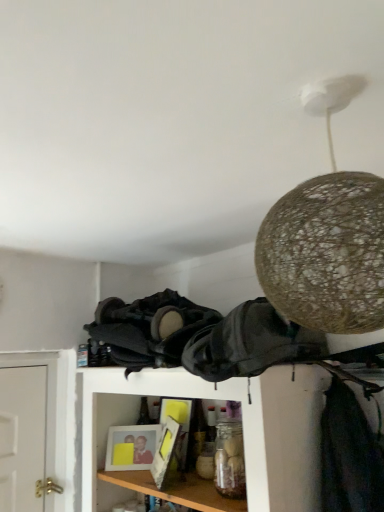
Find the location of a particular element. This screenshot has width=384, height=512. matte plastic picture frame at lower center is located at coordinates (131, 447).

Measure the distance between point (x=250, y=361) and camera.

Point (x=250, y=361) is 3.41 feet from camera.

Find the location of a particular element. This screenshot has height=512, width=384. woven beige lampshade at upper right is located at coordinates (327, 237).

Choose the correct answer: Is matte plastic picture frame at lower center inside black leather backpack at center, which ranks as the 1th clothing in right-to-left order, or outside it?

matte plastic picture frame at lower center cannot be found inside black leather backpack at center, which ranks as the 1th clothing in right-to-left order.

Locate an element on the screen. This screenshot has width=384, height=512. picture frame on the left of black leather backpack at center, which is the second clothing in left-to-right order is located at coordinates (131, 447).

Does matte plastic picture frame at lower center have a lesser height compared to black leather backpack at center, which ranks as the 1th clothing in right-to-left order?

Indeed, matte plastic picture frame at lower center has a lesser height compared to black leather backpack at center, which ranks as the 1th clothing in right-to-left order.

Which object is positioned more to the right, matte plastic picture frame at lower center or black leather backpack at center, which ranks as the 1th clothing in right-to-left order?

From the viewer's perspective, black leather backpack at center, which ranks as the 1th clothing in right-to-left order, appears more on the right side.

Where is `clothing that is the 2nd one when counting backward from the woven beige lampshade at upper right`? The image size is (384, 512). clothing that is the 2nd one when counting backward from the woven beige lampshade at upper right is located at coordinates (146, 330).

Can you confirm if black fabric at center, acting as the second clothing starting from the right, is wider than woven beige lampshade at upper right?

Incorrect, the width of black fabric at center, acting as the second clothing starting from the right, does not surpass that of woven beige lampshade at upper right.

Based on the photo, are black fabric at center, acting as the second clothing starting from the right, and woven beige lampshade at upper right far apart?

No.

Could you measure the distance between black fabric at center, which is the first clothing from left to right, and woven beige lampshade at upper right?

They are 28.91 inches apart.

From a real-world perspective, is black fabric at center, which is the first clothing from left to right, positioned above or below matte plastic picture frame at lower center?

In terms of real-world spatial position, black fabric at center, which is the first clothing from left to right, is above matte plastic picture frame at lower center.

From the image's perspective, would you say black fabric at center, which is the first clothing from left to right, is positioned over matte plastic picture frame at lower center?

Yes, from the image's perspective, black fabric at center, which is the first clothing from left to right, is on top of matte plastic picture frame at lower center.

Locate an element on the screen. the 1st clothing above the matte plastic picture frame at lower center (from the image's perspective) is located at coordinates (146, 330).

How much distance is there between black fabric at center, which is the first clothing from left to right, and matte plastic picture frame at lower center?

They are 17.53 inches apart.

Image resolution: width=384 pixels, height=512 pixels. In order to click on picture frame on the left of woven beige lampshade at upper right in this screenshot , I will do `click(131, 447)`.

Is matte plastic picture frame at lower center with woven beige lampshade at upper right?

matte plastic picture frame at lower center and woven beige lampshade at upper right are clearly separated.

Is matte plastic picture frame at lower center located outside black fabric at center, which is the first clothing from left to right?

Absolutely, matte plastic picture frame at lower center is external to black fabric at center, which is the first clothing from left to right.

Where is `picture frame to the left of black fabric at center, acting as the second clothing starting from the right`? This screenshot has width=384, height=512. picture frame to the left of black fabric at center, acting as the second clothing starting from the right is located at coordinates (131, 447).

Consider the image. Is matte plastic picture frame at lower center bigger than black fabric at center, acting as the second clothing starting from the right?

No.

Is black leather backpack at center, which ranks as the 1th clothing in right-to-left order, facing towards black fabric at center, which is the first clothing from left to right?

No.

How much distance is there between black leather backpack at center, which is the second clothing in left-to-right order, and black fabric at center, which is the first clothing from left to right?

black leather backpack at center, which is the second clothing in left-to-right order, and black fabric at center, which is the first clothing from left to right, are 8.59 inches apart from each other.

Does point (264, 370) appear closer or farther from the camera than point (107, 320)?

Point (264, 370) appears to be closer to the viewer than point (107, 320).

Is black leather backpack at center, which ranks as the 1th clothing in right-to-left order, directly adjacent to black fabric at center, acting as the second clothing starting from the right?

No.

From the image's perspective, is black fabric at center, which is the first clothing from left to right, under black leather backpack at center, which is the second clothing in left-to-right order?

Yes.

Is black fabric at center, which is the first clothing from left to right, far from black leather backpack at center, which is the second clothing in left-to-right order?

Actually, black fabric at center, which is the first clothing from left to right, and black leather backpack at center, which is the second clothing in left-to-right order, are a little close together.

I want to click on clothing that appears above the black fabric at center, which is the first clothing from left to right (from the image's perspective), so click(250, 344).

What are the coordinates of `the 2nd clothing positioned above the matte plastic picture frame at lower center (from the image's perspective)` in the screenshot? It's located at (250, 344).

Where is `lamp in front of the black fabric at center, acting as the second clothing starting from the right`? Image resolution: width=384 pixels, height=512 pixels. lamp in front of the black fabric at center, acting as the second clothing starting from the right is located at coordinates (327, 237).

Based on the photo, based on their spatial positions, is matte plastic picture frame at lower center or woven beige lampshade at upper right further from black fabric at center, acting as the second clothing starting from the right?

woven beige lampshade at upper right is positioned further to the anchor black fabric at center, acting as the second clothing starting from the right.

Looking at this image, which object lies further to the anchor point black fabric at center, which is the first clothing from left to right, black leather backpack at center, which is the second clothing in left-to-right order, or matte plastic picture frame at lower center?

matte plastic picture frame at lower center lies further to black fabric at center, which is the first clothing from left to right, than the other object.

When comparing their distances from woven beige lampshade at upper right, does black leather backpack at center, which is the second clothing in left-to-right order, or black fabric at center, acting as the second clothing starting from the right, seem further?

Based on the image, black fabric at center, acting as the second clothing starting from the right, appears to be further to woven beige lampshade at upper right.

Estimate the real-world distances between objects in this image. Which object is closer to woven beige lampshade at upper right, black fabric at center, acting as the second clothing starting from the right, or black leather backpack at center, which is the second clothing in left-to-right order?

black leather backpack at center, which is the second clothing in left-to-right order, is positioned closer to the anchor woven beige lampshade at upper right.

From the image, which object appears to be farther from matte plastic picture frame at lower center, black leather backpack at center, which is the second clothing in left-to-right order, or black fabric at center, acting as the second clothing starting from the right?

Among the two, black leather backpack at center, which is the second clothing in left-to-right order, is located further to matte plastic picture frame at lower center.

Considering their positions, is matte plastic picture frame at lower center positioned further to woven beige lampshade at upper right than black fabric at center, acting as the second clothing starting from the right?

Based on the image, matte plastic picture frame at lower center appears to be further to woven beige lampshade at upper right.

Estimate the real-world distances between objects in this image. Which object is closer to woven beige lampshade at upper right, black leather backpack at center, which is the second clothing in left-to-right order, or matte plastic picture frame at lower center?

Among the two, black leather backpack at center, which is the second clothing in left-to-right order, is located nearer to woven beige lampshade at upper right.

Based on their spatial positions, is black fabric at center, which is the first clothing from left to right, or matte plastic picture frame at lower center closer to black leather backpack at center, which ranks as the 1th clothing in right-to-left order?

black fabric at center, which is the first clothing from left to right, lies closer to black leather backpack at center, which ranks as the 1th clothing in right-to-left order, than the other object.

The width and height of the screenshot is (384, 512). In order to click on clothing between black leather backpack at center, which is the second clothing in left-to-right order, and matte plastic picture frame at lower center from front to back in this screenshot , I will do `click(146, 330)`.

This screenshot has height=512, width=384. In order to click on clothing located between woven beige lampshade at upper right and black fabric at center, which is the first clothing from left to right, in the depth direction in this screenshot , I will do `click(250, 344)`.